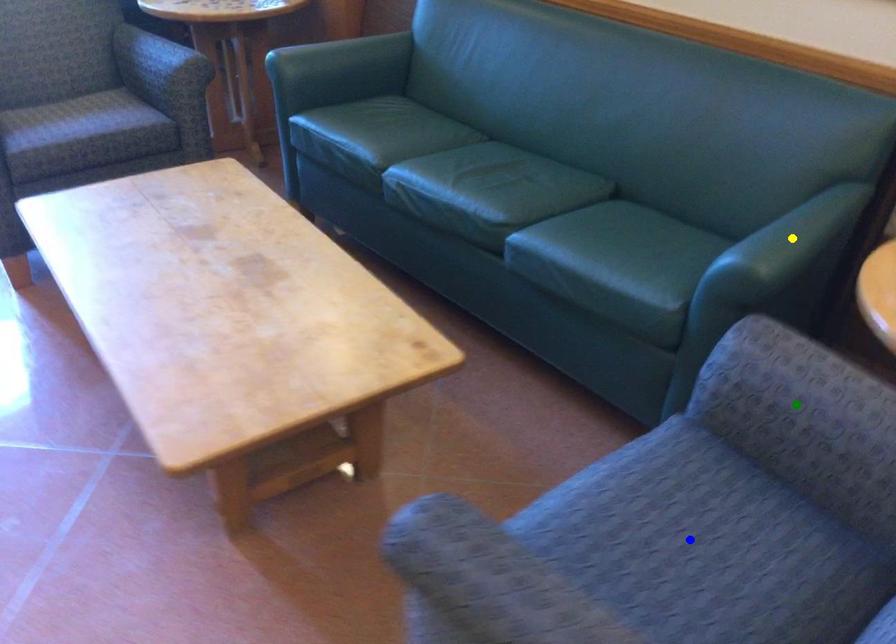
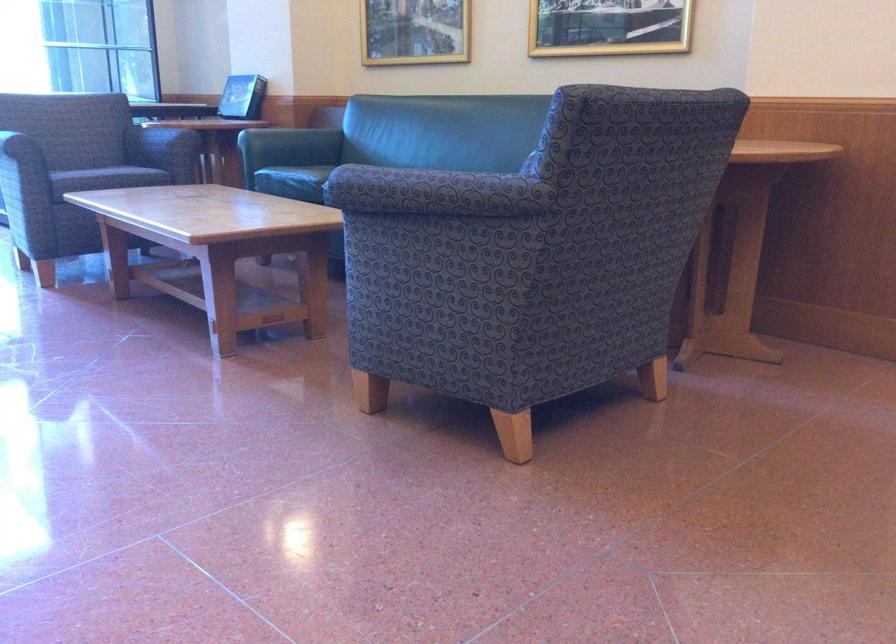
I am providing you with two images of the same scene from different viewpoints. Three points are marked in image1. Which point corresponds to a part or object that is occluded in image2?In image1, three points are marked. Which of them correspond to a part or object that is occluded in image2?Among the three points shown in image1, which one corresponds to a part or object that is no longer visible due to occlusion in image2?

Invisible in image2: green point, yellow point, blue point.